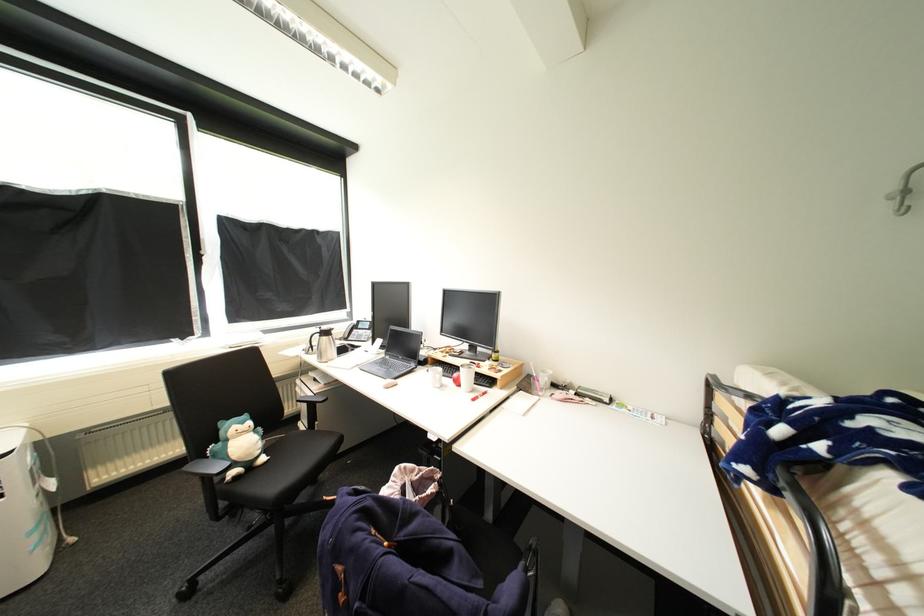
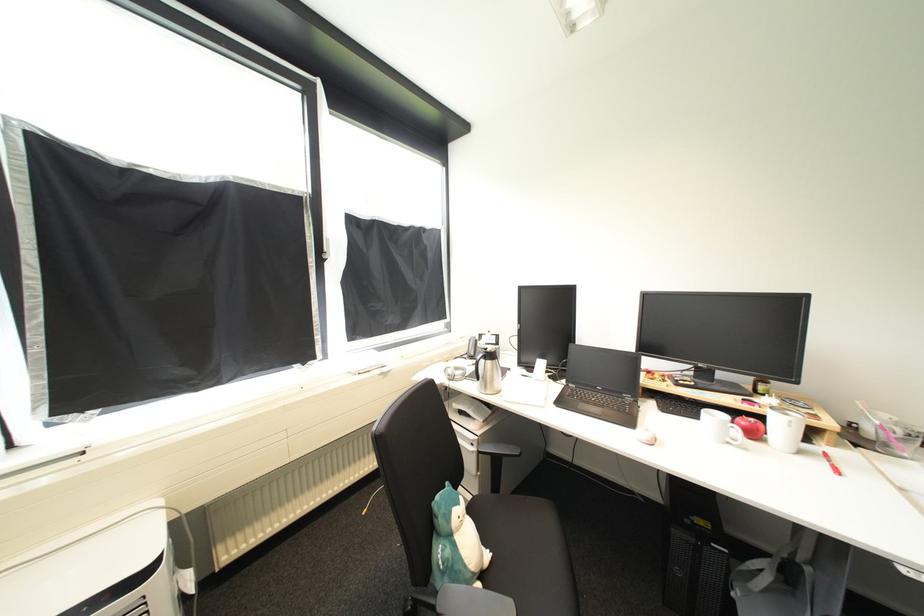
Locate, in the second image, the point that corresponds to (466,384) in the first image.

(761, 436)